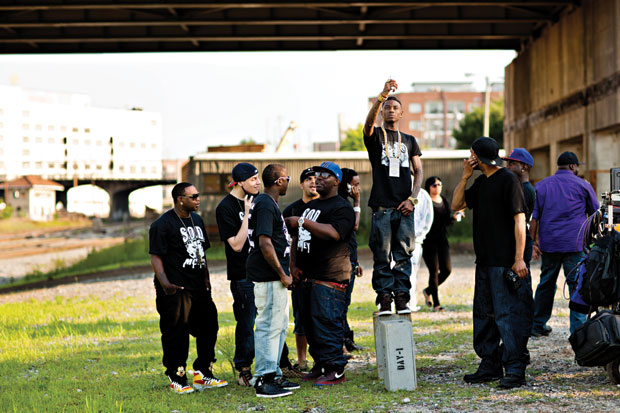
You are a GUI agent. You are given a task and a screenshot of the screen. Output one action in this format:
    pyautogui.click(x=<x>, y=<y>)
    Task: Click on the wall
    The image size is (620, 413).
    Given the screenshot: What is the action you would take?
    pyautogui.click(x=570, y=44)